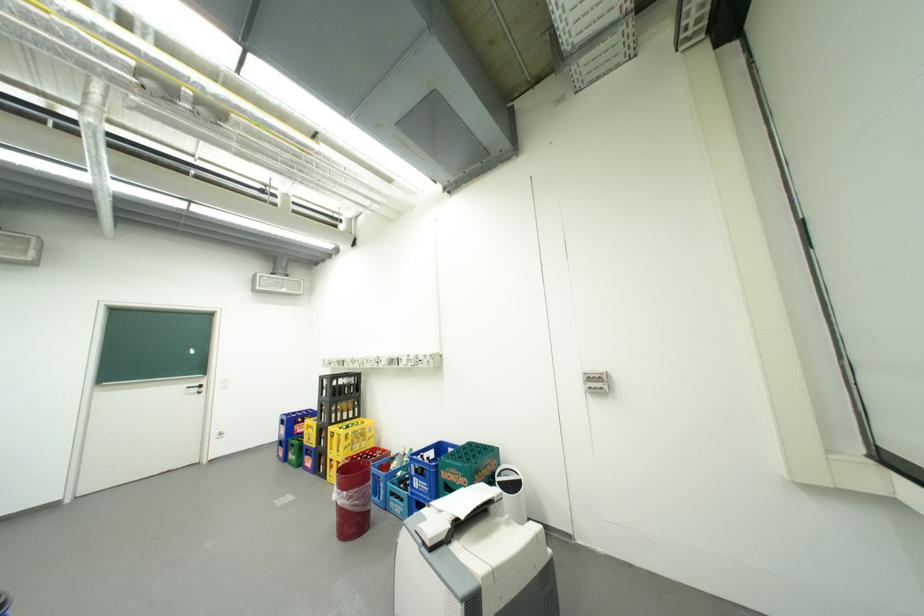
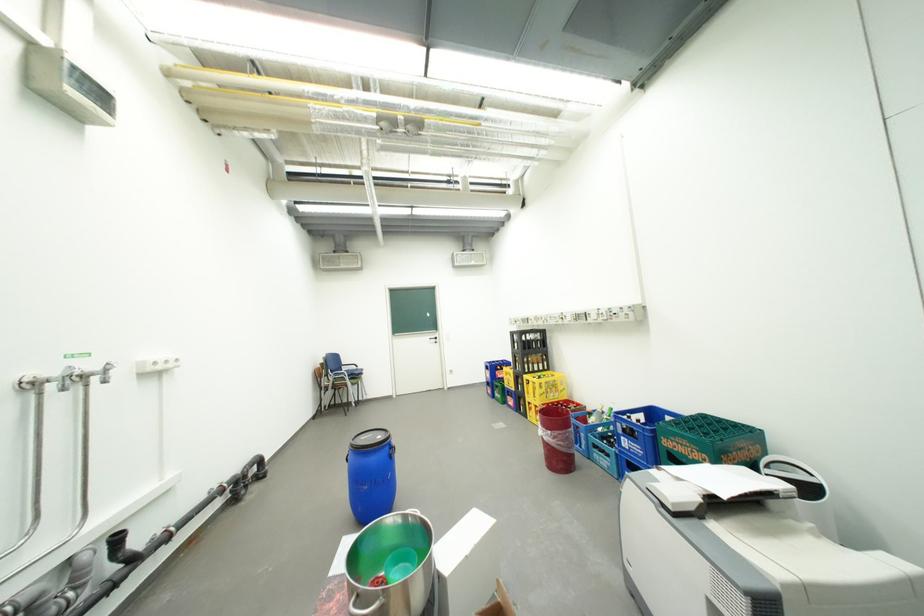
Question: How did the camera likely rotate?

Choices:
 (A) Left
 (B) Right
 (C) Up
 (D) Down

Answer: (A)